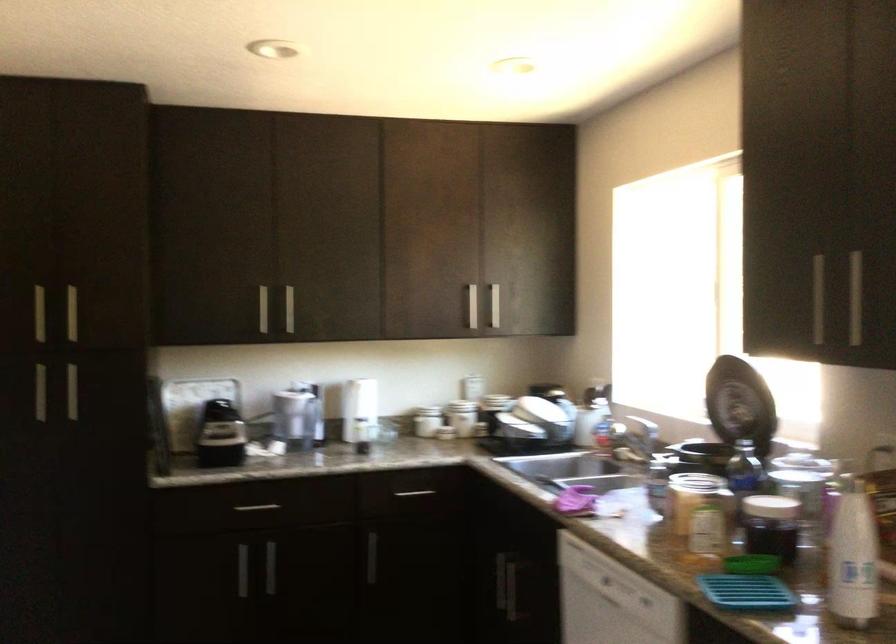
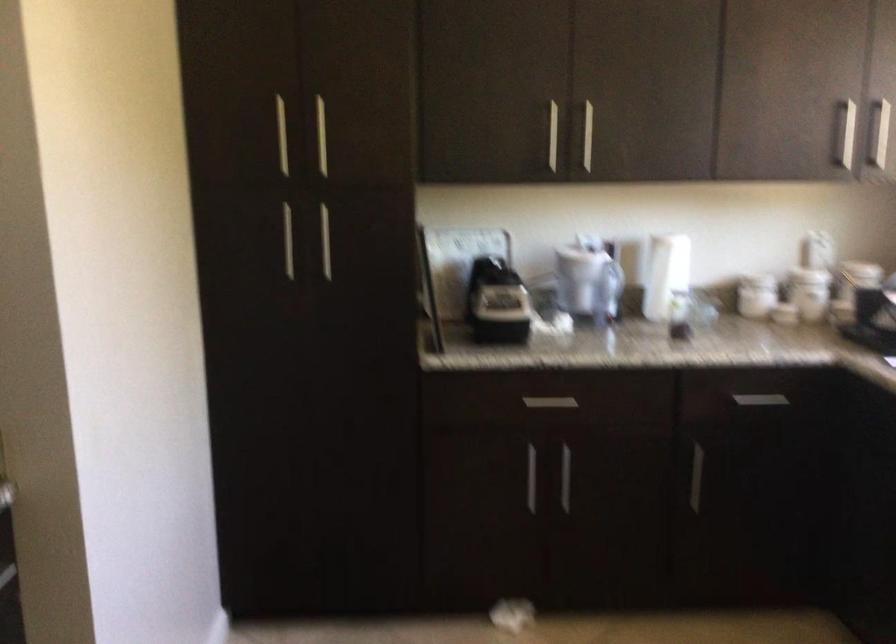
The point at (x=294, y=413) is marked in the first image. Where is the corresponding point in the second image?

(588, 279)